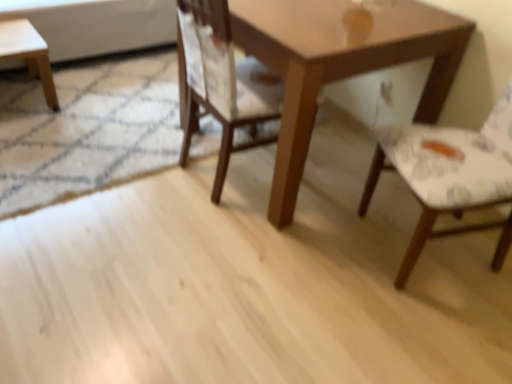
Question: Is light brown wooden stool at left in front of or behind wooden table at center in the image?

Choices:
 (A) front
 (B) behind

Answer: (B)

Question: Based on their positions, is light brown wooden stool at left located to the left or right of wooden table at center?

Choices:
 (A) left
 (B) right

Answer: (A)

Question: Which object is the farthest from the wooden table at center?

Choices:
 (A) wooden chair at center, acting as the second chair starting from the right
 (B) white fabric chair at right, marked as the 2th chair in a left-to-right arrangement
 (C) light brown wooden stool at left

Answer: (C)

Question: Considering the real-world distances, which object is closest to the wooden table at center?

Choices:
 (A) white fabric chair at right, marked as the 2th chair in a left-to-right arrangement
 (B) wooden chair at center, acting as the second chair starting from the right
 (C) light brown wooden stool at left

Answer: (B)